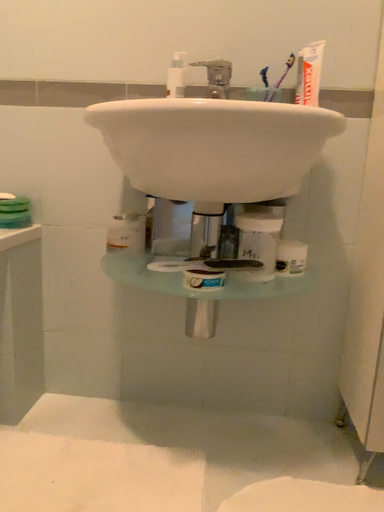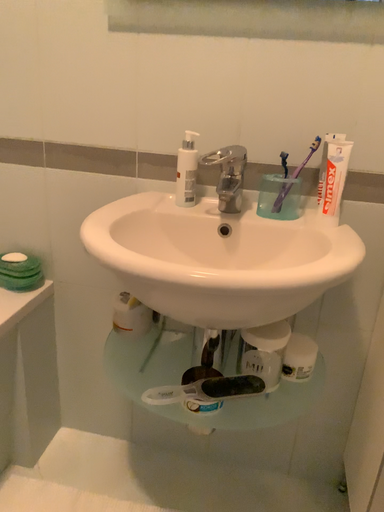
Question: How did the camera likely rotate when shooting the video?

Choices:
 (A) rotated downward
 (B) rotated upward

Answer: (A)